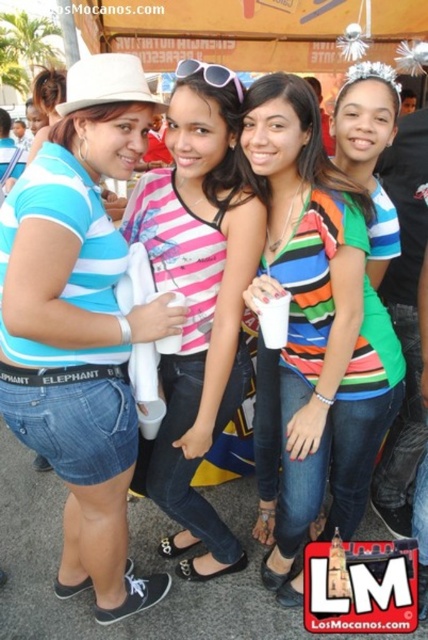
Who is positioned more to the left, striped jersey at center or pink striped shirt at center?

pink striped shirt at center

You are a GUI agent. You are given a task and a screenshot of the screen. Output one action in this format:
    pyautogui.click(x=<x>, y=<y>)
    Task: Click on the striped jersey at center
    The image size is (428, 640).
    Given the screenshot: What is the action you would take?
    pyautogui.click(x=318, y=323)

Find the location of `striped jersey at center`. striped jersey at center is located at coordinates (318, 323).

Does blue striped shirt at center have a lesser width compared to striped jersey at center?

No, blue striped shirt at center is not thinner than striped jersey at center.

Is blue striped shirt at center bigger than striped jersey at center?

Yes.

The height and width of the screenshot is (640, 428). Describe the element at coordinates (80, 324) in the screenshot. I see `blue striped shirt at center` at that location.

Find the location of a particular element. The image size is (428, 640). blue striped shirt at center is located at coordinates coord(80,324).

Does point (68, 566) come behind point (175, 182)?

Yes, point (68, 566) is farther from viewer.

Between blue striped shirt at center and pink striped shirt at center, which one appears on the right side from the viewer's perspective?

From the viewer's perspective, pink striped shirt at center appears more on the right side.

Is point (59, 284) closer to camera compared to point (172, 419)?

Yes.

The image size is (428, 640). I want to click on blue striped shirt at center, so click(x=80, y=324).